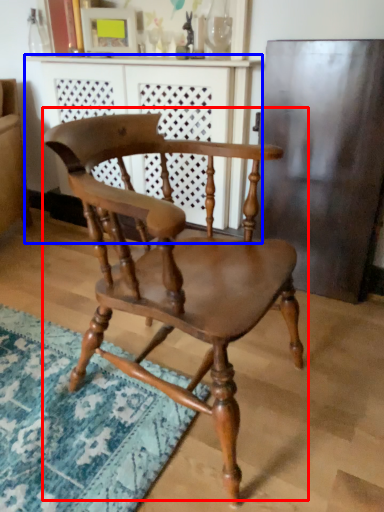
Question: Which of the following is the closest to the observer, chair (highlighted by a red box) or dresser (highlighted by a blue box)?

Choices:
 (A) chair
 (B) dresser

Answer: (A)